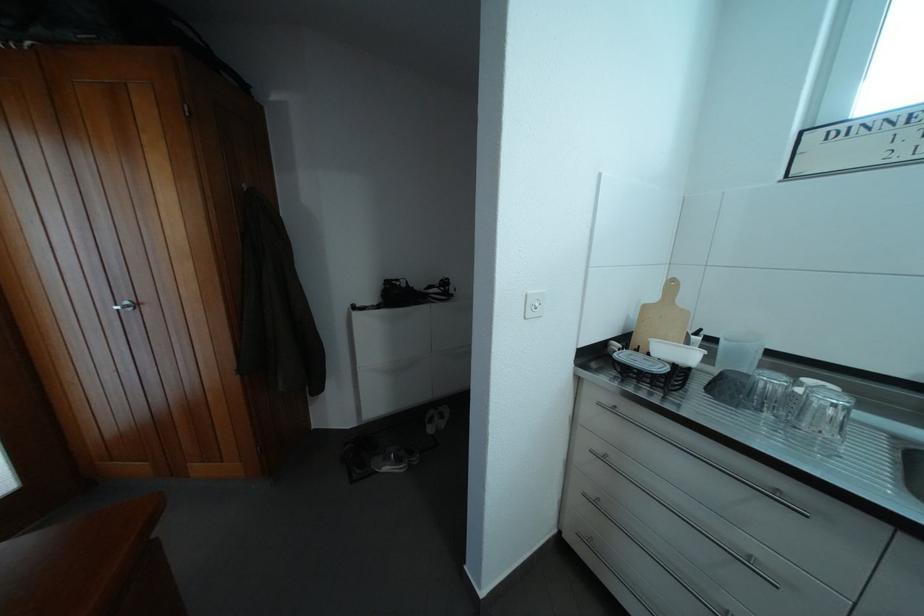
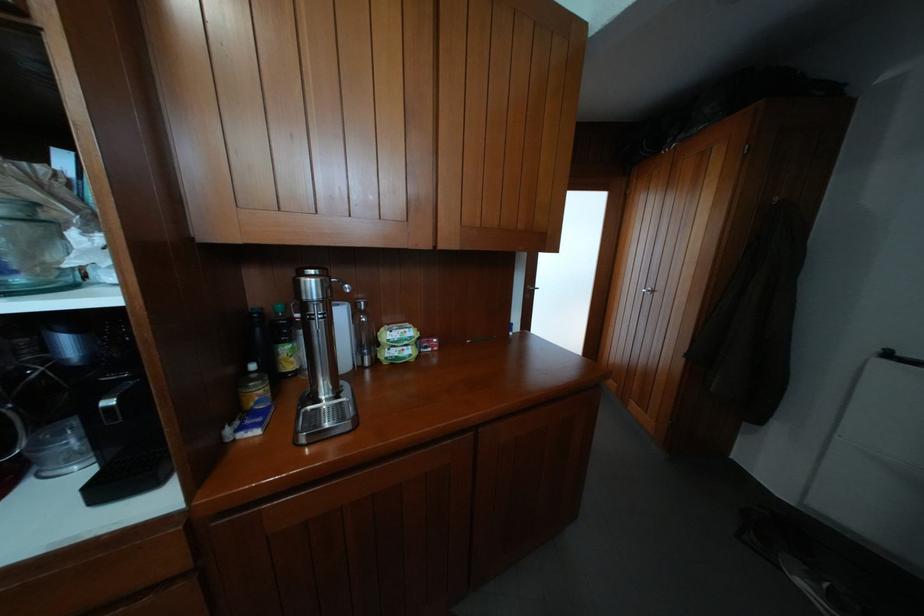
Question: The first image is from the beginning of the video and the second image is from the end. How did the camera likely rotate when shooting the video?

Choices:
 (A) Left
 (B) Right
 (C) Up
 (D) Down

Answer: (A)